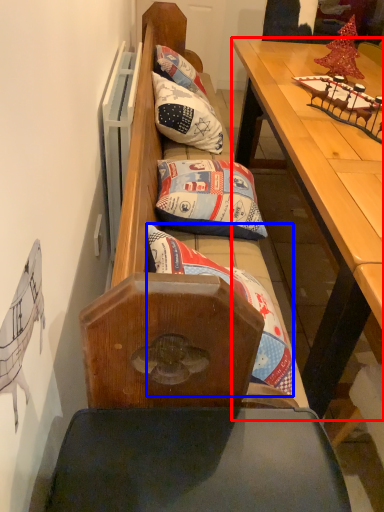
Question: Among these objects, which one is farthest to the camera, table (highlighted by a red box) or pillow (highlighted by a blue box)?

Choices:
 (A) table
 (B) pillow

Answer: (B)